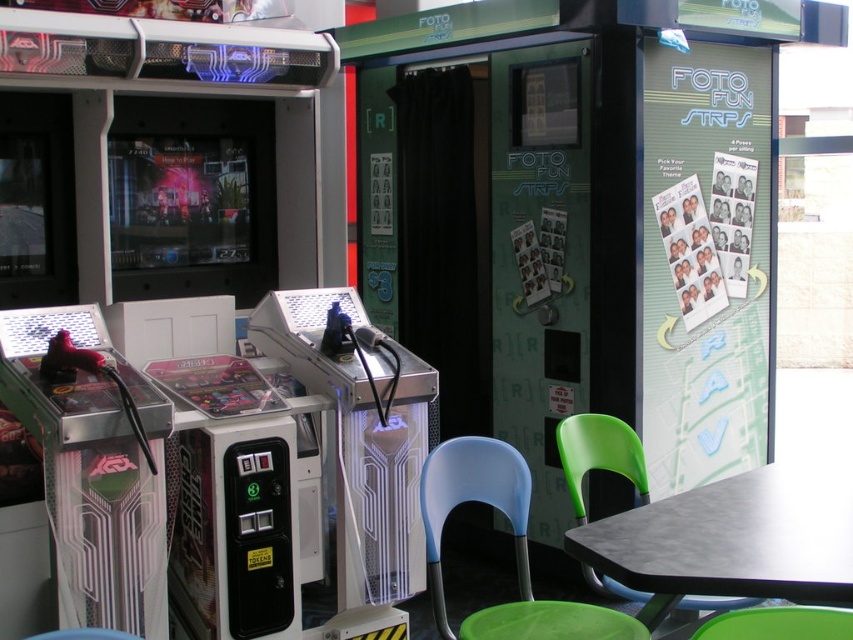
Question: Which of the following is the closest to the observer?

Choices:
 (A) (444, 506)
 (B) (714, 637)
 (C) (837, 534)

Answer: (B)

Question: Is black matte table at lower right thinner than blue plastic chair at lower center?

Choices:
 (A) no
 (B) yes

Answer: (A)

Question: Which point is closer to the camera?

Choices:
 (A) blue plastic chair at lower center
 (B) black matte table at lower right
 (C) green plastic chair at lower center

Answer: (C)

Question: Does black matte table at lower right have a lesser width compared to blue plastic chair at lower center?

Choices:
 (A) no
 (B) yes

Answer: (A)

Question: Does black matte table at lower right appear over green plastic chair at lower center?

Choices:
 (A) yes
 (B) no

Answer: (B)

Question: Which point is closer to the camera taking this photo?

Choices:
 (A) (821, 460)
 (B) (462, 636)
 (C) (764, 616)

Answer: (C)